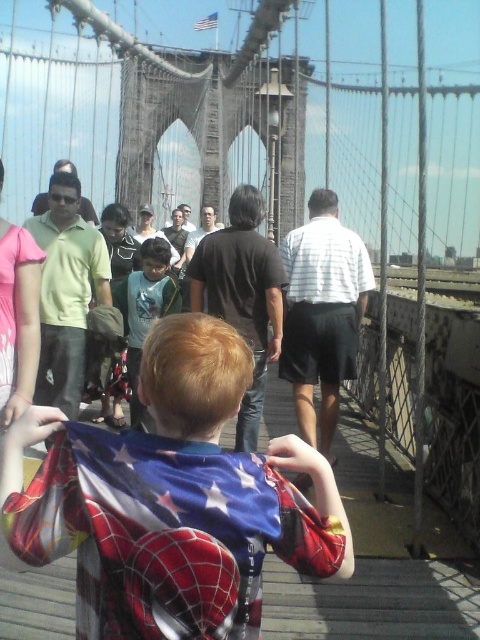
You are a photographer standing on the Brooklyn Bridge and want to take a photo of the light blue shirt at center and the white fabric flag at upper center. Can you see both objects clearly in the same frame without any obstruction?

Yes, the light blue shirt at center is in front of the white fabric flag at upper center, so both can be seen clearly in the same frame as the flag will be partially visible behind the shirt.

You are a photographer trying to capture a photo of both the Spiderman costume at center and the light blue shirt at center. Which object should you focus on first if you want to ensure both are in the frame?

The spiderman costume at center is much taller than the light blue shirt at center, so you should focus on the spiderman costume at center first to ensure both are in the frame.

You are standing on the Brooklyn Bridge and see two points marked on the walkway. The first point is at coordinates point (116, 596) and the second point is at point (140, 333). If you are facing the bridge towers, which point is closer to you?

Point (116, 596) is in front of point (140, 333), so it is closer to you when facing the bridge towers.